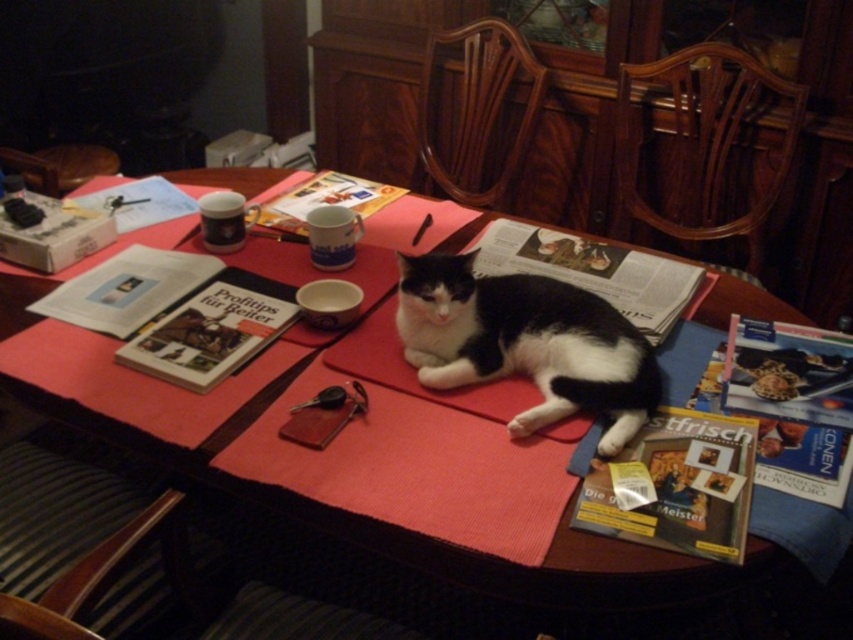
You are planning to place a rectangular tray on the table. The tray is as wide as the black and white fur cat at center. Will the tray fit entirely on the smooth wooden table at center without overhanging the edges?

The smooth wooden table at center is wider than the black and white fur cat at center. Since the tray is as wide as the cat, it will fit entirely on the smooth wooden table at center without overhanging the edges.

Looking at this image, please check the coordinates given in the objects section. What is located at point (x=363, y=497)?

The smooth wooden table at center is located at point (x=363, y=497).

You are a small toy mouse that is 2 inches long. You want to roll from the edge of the smooth wooden table at center to the black and white fur cat at center. Is there enough space for you to reach the cat without falling off the table?

The smooth wooden table at center is 6.73 inches from the black and white fur cat at center. Since the toy mouse is only 2 inches long, there is sufficient space for it to roll from the edge of the table to the cat without falling off.